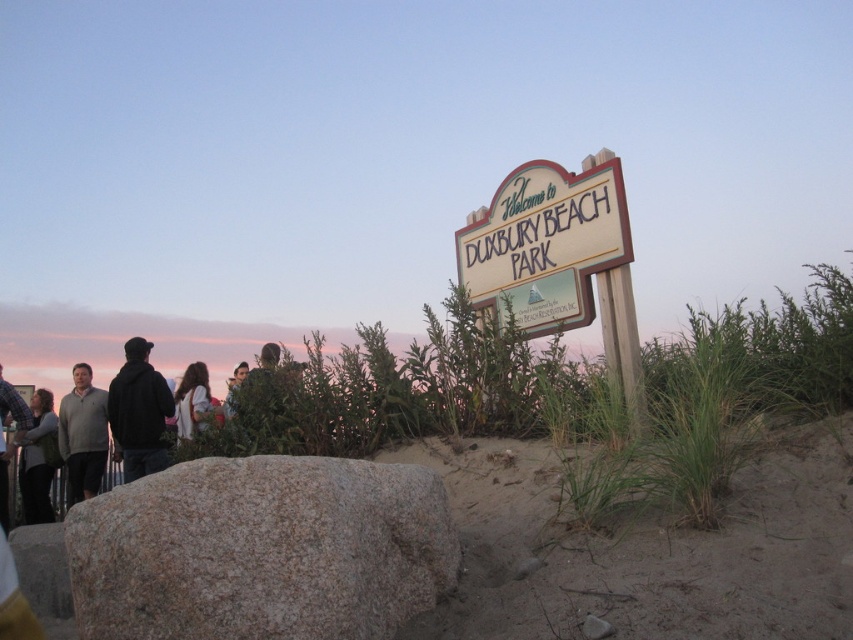
Which is behind, point (578, 209) or point (236, 378)?

The point (236, 378) is more distant.

Which is in front, point (506, 237) or point (241, 376)?

Positioned in front is point (506, 237).

Which is in front, point (541, 196) or point (245, 362)?

Point (541, 196)

Find the location of a particular element. beige wood sign at center is located at coordinates (546, 230).

Between granite rock at lower left and black hoodie at left, which one appears on the left side from the viewer's perspective?

From the viewer's perspective, black hoodie at left appears more on the left side.

Is granite rock at lower left wider than black hoodie at left?

Indeed, granite rock at lower left has a greater width compared to black hoodie at left.

Is point (312, 509) farther from viewer compared to point (137, 476)?

No, it is not.

Image resolution: width=853 pixels, height=640 pixels. What are the coordinates of `granite rock at lower left` in the screenshot? It's located at (260, 550).

Does light brown sandy dunes at lower center have a larger size compared to matte gray sweater at lower left?

Yes, light brown sandy dunes at lower center is bigger than matte gray sweater at lower left.

Can you confirm if light brown sandy dunes at lower center is positioned above matte gray sweater at lower left?

Correct, light brown sandy dunes at lower center is located above matte gray sweater at lower left.

Is point (492, 492) more distant than point (44, 504)?

No, (492, 492) is in front of (44, 504).

Where is `light brown sandy dunes at lower center`? This screenshot has height=640, width=853. light brown sandy dunes at lower center is located at coordinates tap(647, 548).